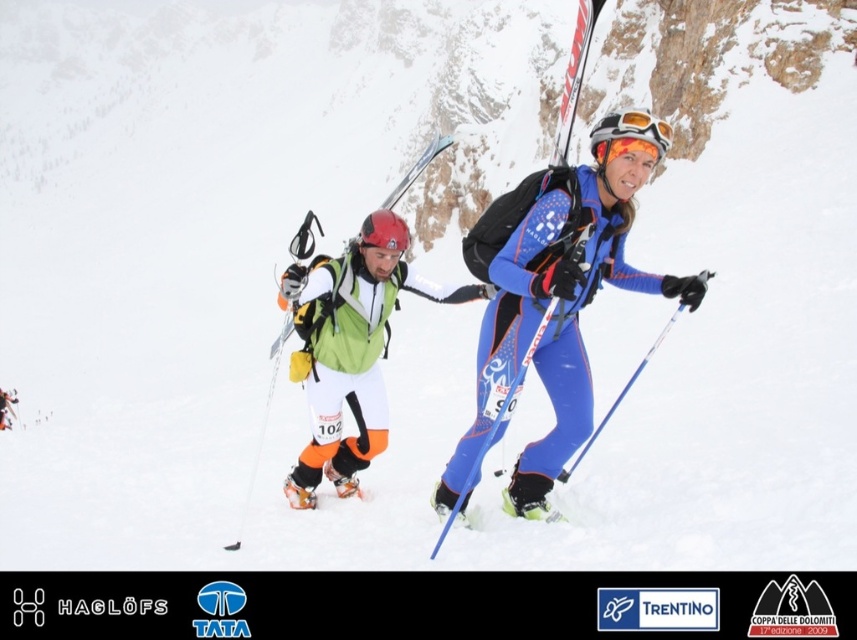
Does blue/orange ski suit at center appear on the left side of matte green ski at center-left?

No, blue/orange ski suit at center is not to the left of matte green ski at center-left.

Which is below, blue/orange ski suit at center or matte green ski at center-left?

blue/orange ski suit at center is below.

I want to click on blue/orange ski suit at center, so click(x=554, y=310).

Locate an element on the screen. Image resolution: width=857 pixels, height=640 pixels. blue/orange ski suit at center is located at coordinates [554, 310].

Between point (291, 310) and point (670, 140), which one is positioned behind?

The point (291, 310) is behind.

Between matte green ski at center-left and orange reflective goggles at center, which one appears on the right side from the viewer's perspective?

From the viewer's perspective, orange reflective goggles at center appears more on the right side.

Where is `matte green ski at center-left`? The image size is (857, 640). matte green ski at center-left is located at coordinates (417, 170).

Can you confirm if green fabric jacket at center is thinner than matte green ski at center-left?

Correct, green fabric jacket at center's width is less than matte green ski at center-left's.

Can you confirm if green fabric jacket at center is taller than matte green ski at center-left?

No.

Which is in front, point (402, 280) or point (358, 278)?

Point (358, 278)

This screenshot has height=640, width=857. Identify the location of green fabric jacket at center. (345, 353).